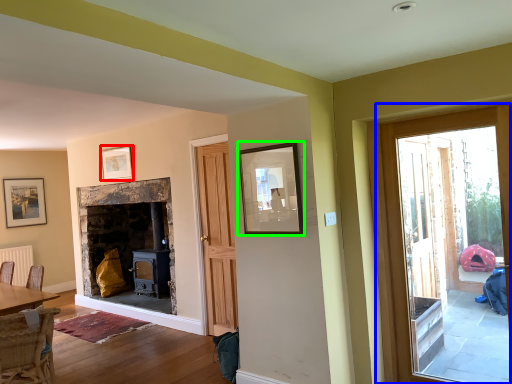
Question: Estimate the real-world distances between objects in this image. Which object is farther from picture frame (highlighted by a red box), door (highlighted by a blue box) or picture frame (highlighted by a green box)?

Choices:
 (A) door
 (B) picture frame

Answer: (A)